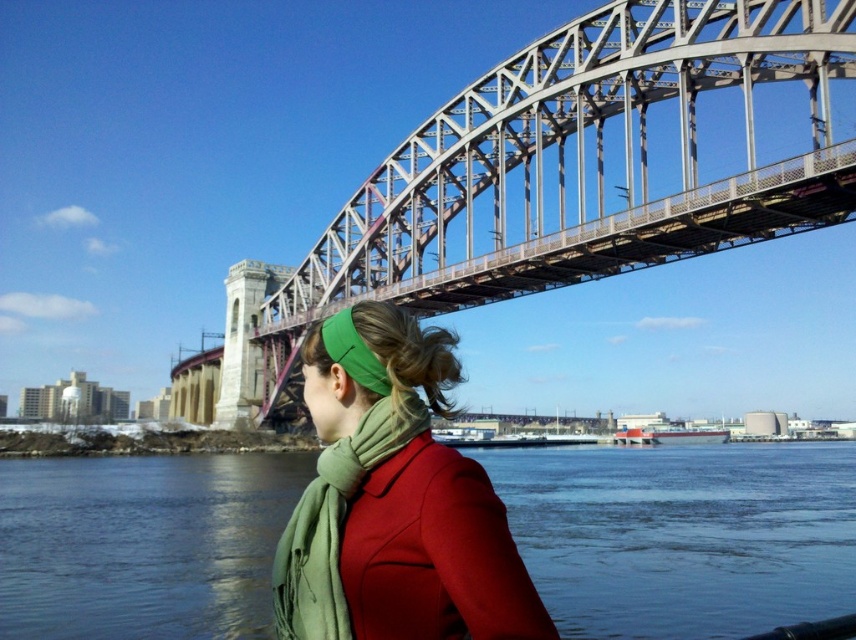
Is blue water at center wider than green soft scarf at center?

Yes.

Is blue water at center below green soft scarf at center?

Yes.

Between point (79, 627) and point (361, 420), which one is positioned behind?

Positioned behind is point (79, 627).

I want to click on blue water at center, so click(x=682, y=536).

Does blue water at center have a smaller size compared to green matte headband at upper center?

No.

Who is higher up, blue water at center or green matte headband at upper center?

Positioned higher is green matte headband at upper center.

You are a GUI agent. You are given a task and a screenshot of the screen. Output one action in this format:
    pyautogui.click(x=<x>, y=<y>)
    Task: Click on the blue water at center
    This screenshot has height=640, width=856.
    Given the screenshot: What is the action you would take?
    pyautogui.click(x=682, y=536)

Is metallic steel bridge at upper center positioned before green matte headband at upper center?

No, metallic steel bridge at upper center is behind green matte headband at upper center.

Between metallic steel bridge at upper center and green matte headband at upper center, which one appears on the left side from the viewer's perspective?

From the viewer's perspective, green matte headband at upper center appears more on the left side.

Is point (397, 166) behind point (302, 572)?

Yes, point (397, 166) is behind point (302, 572).

I want to click on metallic steel bridge at upper center, so click(574, 173).